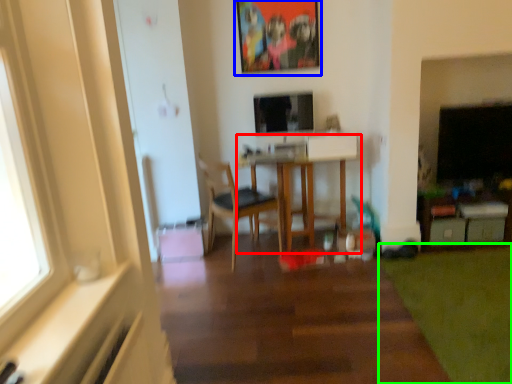
Question: Estimate the real-world distances between objects in this image. Which object is closer to table (highlighted by a red box), picture frame (highlighted by a blue box) or grass (highlighted by a green box)?

Choices:
 (A) picture frame
 (B) grass

Answer: (A)